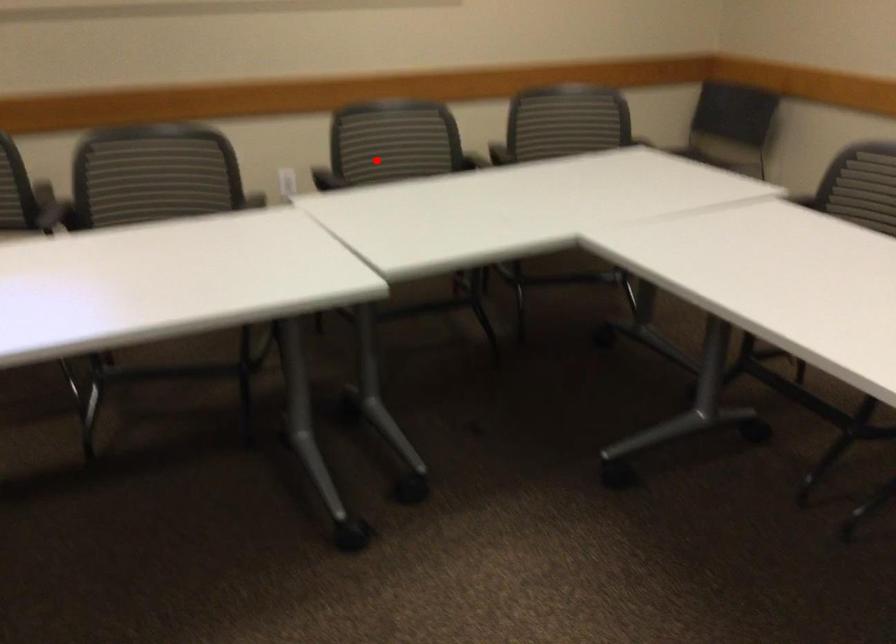
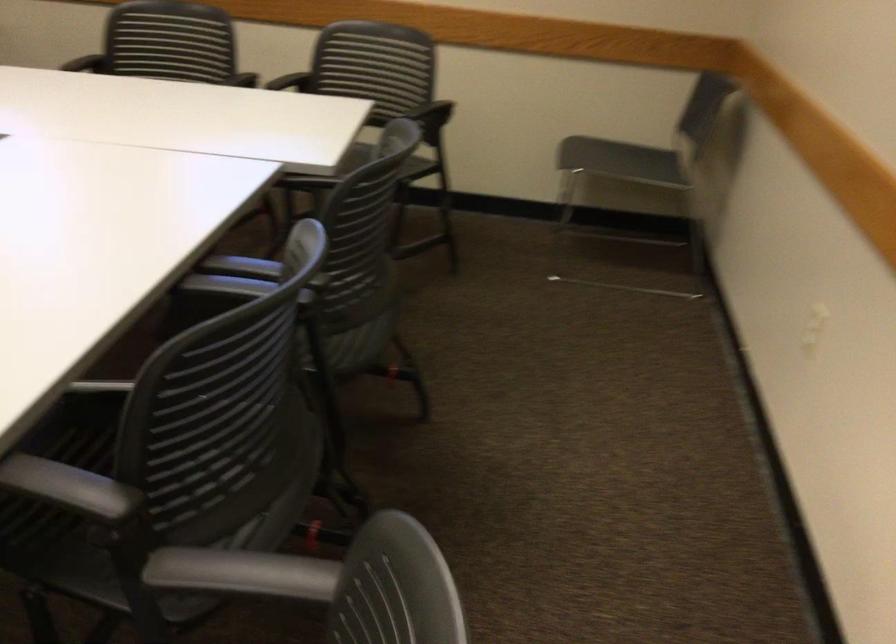
In the second image, find the point that corresponds to the highlighted location in the first image.

(300, 75)